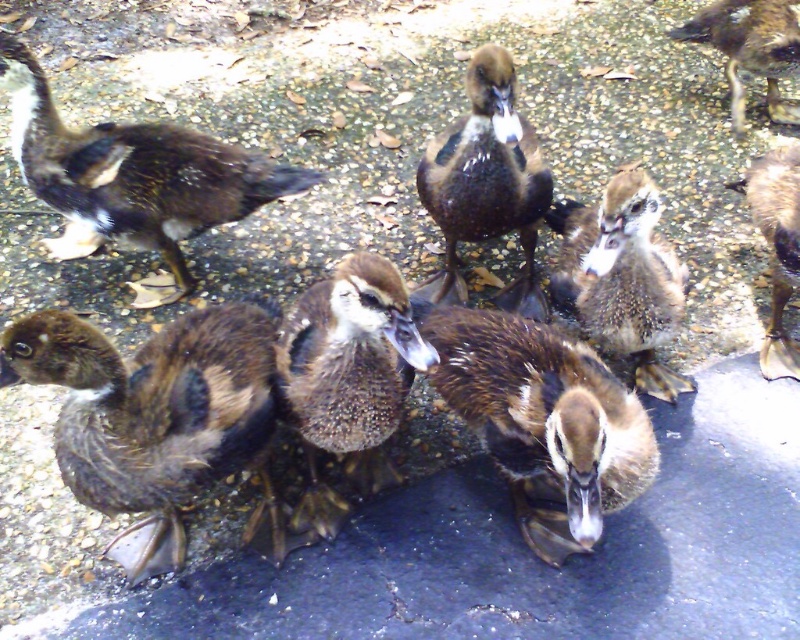
You are a wildlife photographer aiming to capture a closeup shot of the brown glossy duckling at center and the speckled feather duckling at center. Since your camera can only focus on one duckling at a time, which duckling should you choose to ensure the focus is sharp if the camera has a limited focus range that accommodates smaller subjects better?

The brown glossy duckling at center has a smaller width than the speckled feather duckling at center, so the camera with a limited focus range that accommodates smaller subjects better should focus on the brown glossy duckling at center for a sharper image.

You are a photographer aiming to capture a closeup shot of the brown glossy duckling at center. Given that your camera is currently focused at point 0.3, 0.6, will you need to adjust the focus to get a clear image of the duckling?

The brown glossy duckling at center is located at point (486, 182), which is very close to the camera focus point of (480, 192). The slight difference in coordinates means minimal adjustment might be needed, but the focus is already nearly aligned. A minor tweak to the focus position could ensure clarity.

You are a wildlife photographer trying to capture a closeup of the brown fuzzy duckling at lower left and the brown fuzzy duckling at right. If you want to ensure both ducklings are in focus, which duckling requires you to adjust your camera focus to a closer distance?

The brown fuzzy duckling at lower left requires adjusting the camera focus to a closer distance because it is larger in size compared to the brown fuzzy duckling at right, which means it is either closer to the camera or naturally larger.